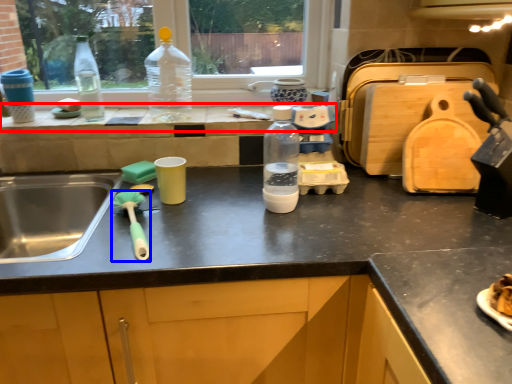
Question: Which object is closer to the camera taking this photo, window sill (highlighted by a red box) or brush (highlighted by a blue box)?

Choices:
 (A) window sill
 (B) brush

Answer: (B)